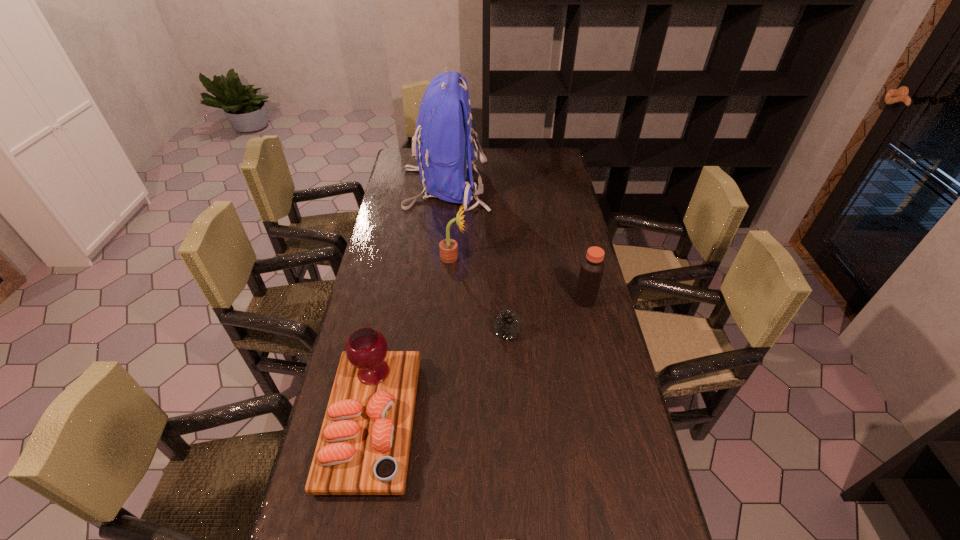
The height and width of the screenshot is (540, 960). I want to click on free region located 0.180m on the front of the rightmost object, so click(x=597, y=353).

Where is `free spot located on the back of the nearest object`? free spot located on the back of the nearest object is located at coordinates (397, 285).

Locate an element on the screen. The width and height of the screenshot is (960, 540). free point located 0.330m on the back of the shortest object is located at coordinates (502, 254).

What are the coordinates of `object at the far edge` in the screenshot? It's located at (443, 139).

Image resolution: width=960 pixels, height=540 pixels. Identify the location of backpack that is positioned at the left edge. (443, 139).

At what (x,y) coordinates should I click in order to perform the action: click on platter at the left edge. Please return your answer as a coordinate pair (x, y). The height and width of the screenshot is (540, 960). Looking at the image, I should click on (363, 448).

At what (x,y) coordinates should I click in order to perform the action: click on object located at the right edge. Please return your answer as a coordinate pair (x, y). The width and height of the screenshot is (960, 540). Looking at the image, I should click on (592, 267).

Locate an element on the screen. object present at the far left corner is located at coordinates (443, 139).

Find the location of a particular element. Image resolution: width=960 pixels, height=540 pixels. free space at the far edge is located at coordinates (515, 156).

In the image, there is a desktop. In order to click on vacant space at the left edge in this screenshot , I will do `click(392, 267)`.